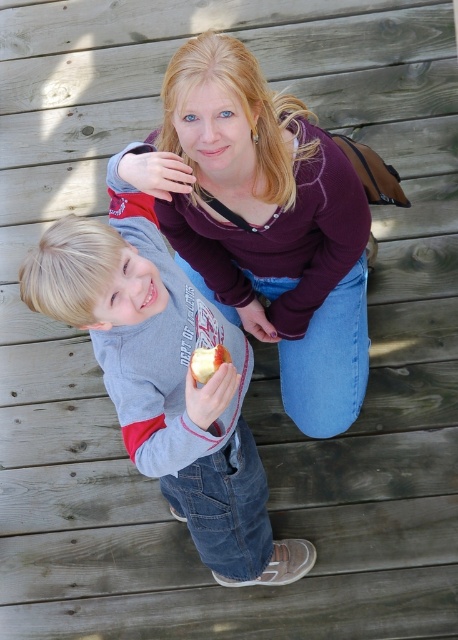
Is matte gray shirt at center shorter than shiny red apple at center?

Incorrect, matte gray shirt at center's height does not fall short of shiny red apple at center's.

Which of these two, matte gray shirt at center or shiny red apple at center, stands shorter?

shiny red apple at center is shorter.

Measure the distance between matte gray shirt at center and camera.

A distance of 1.63 meters exists between matte gray shirt at center and camera.

Identify the location of matte gray shirt at center. Image resolution: width=458 pixels, height=640 pixels. (165, 369).

Does purple sweater at upper center have a lesser width compared to matte gray shirt at center?

Correct, purple sweater at upper center's width is less than matte gray shirt at center's.

Does purple sweater at upper center appear on the left side of matte gray shirt at center?

In fact, purple sweater at upper center is to the right of matte gray shirt at center.

The image size is (458, 640). What do you see at coordinates (270, 225) in the screenshot?
I see `purple sweater at upper center` at bounding box center [270, 225].

Locate an element on the screen. The image size is (458, 640). purple sweater at upper center is located at coordinates (270, 225).

Can you confirm if purple sweater at upper center is positioned to the left of shiny red apple at center?

Incorrect, purple sweater at upper center is not on the left side of shiny red apple at center.

Does purple sweater at upper center have a greater height compared to shiny red apple at center?

Correct, purple sweater at upper center is much taller as shiny red apple at center.

Is point (345, 397) positioned before point (194, 371)?

No, it is behind (194, 371).

Identify the location of purple sweater at upper center. (270, 225).